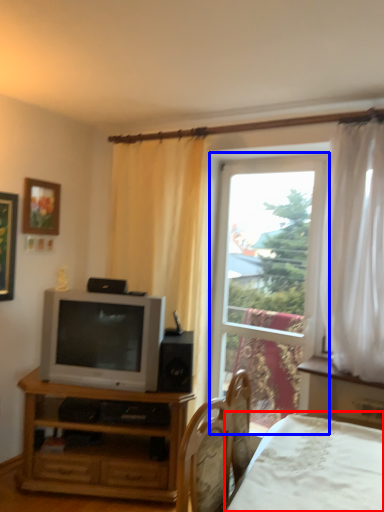
Question: Which point is further to the camera, bed (highlighted by a red box) or window (highlighted by a blue box)?

Choices:
 (A) bed
 (B) window

Answer: (B)